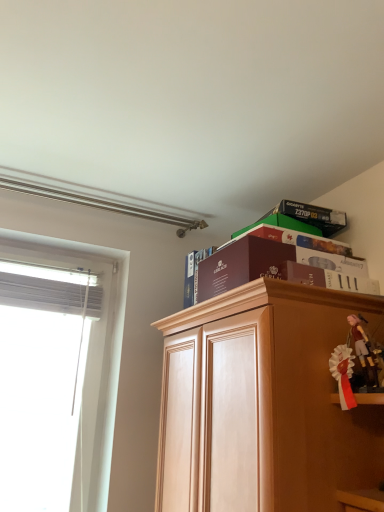
Question: From the image's perspective, is matte black box at upper right above or below pink fabric doll at upper right, which ranks as the first toy in right-to-left order?

Choices:
 (A) below
 (B) above

Answer: (B)

Question: Would you say matte black box at upper right is inside or outside pink fabric doll at upper right, which ranks as the first toy in right-to-left order?

Choices:
 (A) inside
 (B) outside

Answer: (B)

Question: Considering the real-world distances, which object is closest to the light brown wood cabinet at upper right?

Choices:
 (A) white satin ribbon at right, the 2th toy from the right
 (B) pink fabric doll at upper right, which is counted as the 2th toy, starting from the left
 (C) white sheer curtain at left
 (D) maroon cardboard box at upper center, the 2th paperback book positioned from the back
 (E) matte black box at upper right

Answer: (A)

Question: Estimate the real-world distances between objects in this image. Which object is farther from the maroon cardboard box at upper center, positioned as the 1th paperback book in front-to-back order?

Choices:
 (A) matte black box at upper right
 (B) white satin ribbon at right, the 2th toy from the right
 (C) maroon paper at upper center, the first paperback book from the back
 (D) light brown wood cabinet at upper right
 (E) white sheer curtain at left

Answer: (E)